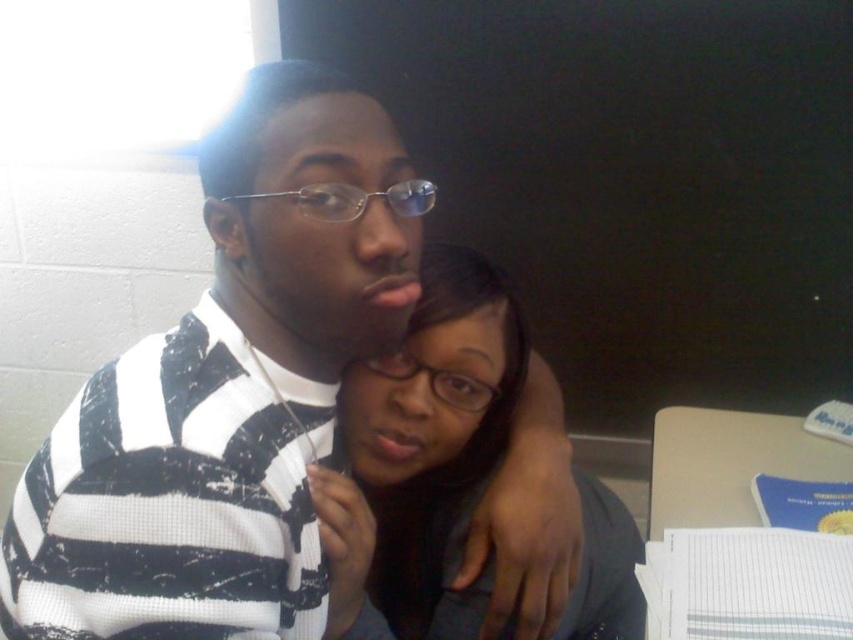
You are a photographer adjusting the focus of your camera. The camera can only focus on objects within a 4 inch range. You need to capture both the striped knit sweater at center and the matte black hair at center in sharp focus. Is this possible?

The distance between the striped knit sweater at center and the matte black hair at center is 4.41 inches, which exceeds the camera focus range of 4 inches. Therefore, it is not possible to have both in sharp focus.

Based on the scene described, which object is positioned to the left of the other between the striped knit sweater at center and the matte black hair at center?

The striped knit sweater at center is to the left of the matte black hair at center.

You are an interior designer assessing the spatial arrangement of the image. Given the striped knit sweater at center and the matte black hair at center, which object occupies a larger vertical space in the scene?

The striped knit sweater at center is much taller than the matte black hair at center, so it occupies a larger vertical space in the scene.